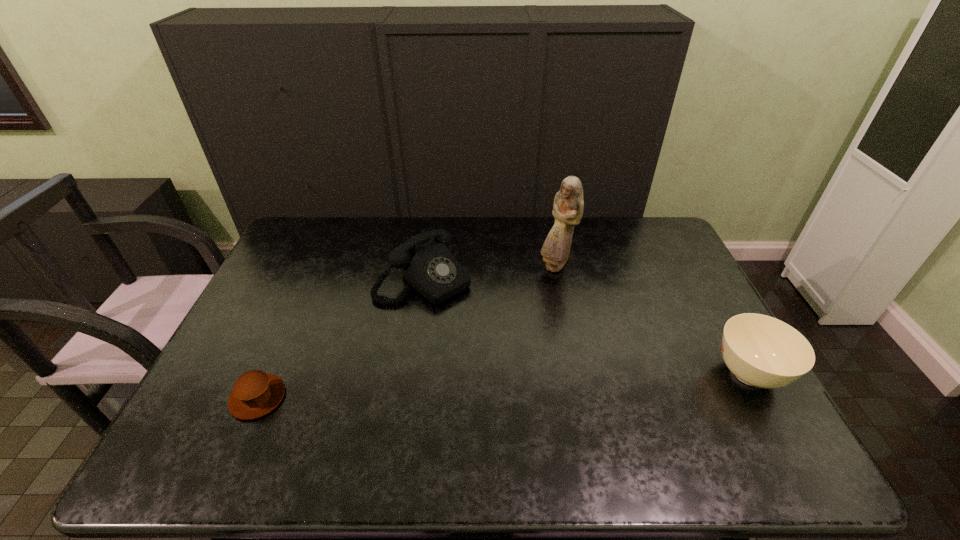
This screenshot has height=540, width=960. Find the location of `free space between the sugar bowl and the leftmost object`. free space between the sugar bowl and the leftmost object is located at coordinates (503, 386).

I want to click on empty location between the sugar bowl and the shortest object, so click(503, 386).

Locate an element on the screen. free space between the second object from left to right and the tallest object is located at coordinates (490, 273).

Locate an element on the screen. The width and height of the screenshot is (960, 540). free space between the second object from right to left and the sugar bowl is located at coordinates (652, 320).

You are a GUI agent. You are given a task and a screenshot of the screen. Output one action in this format:
    pyautogui.click(x=<x>, y=<y>)
    Task: Click on the free space between the shortest object and the sugar bowl
    The height and width of the screenshot is (540, 960).
    Given the screenshot: What is the action you would take?
    pyautogui.click(x=503, y=386)

Find the location of a particular element. free area in between the sugar bowl and the shortest object is located at coordinates (503, 386).

This screenshot has width=960, height=540. I want to click on free space that is in between the sugar bowl and the shortest object, so click(503, 386).

Identify the location of free area in between the sugar bowl and the muffin. (503, 386).

Where is `object that is the closest to the leftmost object`? This screenshot has width=960, height=540. object that is the closest to the leftmost object is located at coordinates (426, 263).

Select which object is the third closest to the tallest object. Please provide its 2D coordinates. Your answer should be formatted as a tuple, i.e. [(x, y)], where the tuple contains the x and y coordinates of a point satisfying the conditions above.

[(255, 393)]